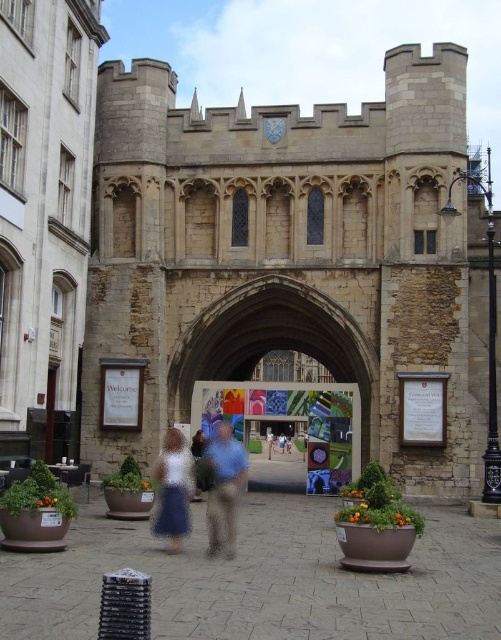
You are standing in front of the historic stone archway and notice two people wearing a blue cotton shirt at center and blue denim shorts at center. Which clothing item is closer to you?

The blue cotton shirt at center is closer to the viewer than the blue denim shorts at center.

You are standing in the courtyard and want to take a photo of the stone archway at center without anyone blocking the view. Are the blue denim shorts at center in the way?

The stone archway at center is in front of blue denim shorts at center, so the archway is closer to you than the shorts. Since the archway is in front, it would block the view of the blue denim shorts at center, but the shorts are behind the archway and won

You are standing in front of the historic stone archway and want to take a photo of the point at coordinates point (x=209, y=518). If your camera has a maximum focus range of 50 meters, will it be able to focus on that point?

The distance of point (x=209, y=518) from the camera is 47.89 meters, which is within the camera maximum focus range of 50 meters. Therefore, the camera can focus on that point.